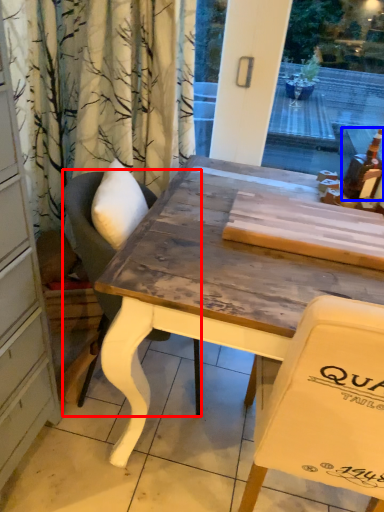
Question: Which point is further to the camera, chair (highlighted by a red box) or alcohol (highlighted by a blue box)?

Choices:
 (A) chair
 (B) alcohol

Answer: (B)